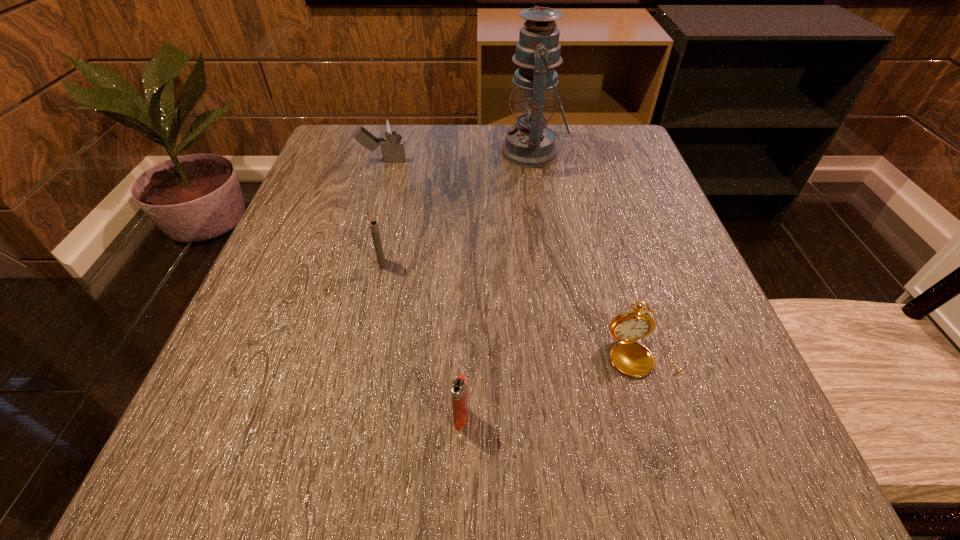
At what (x,y) coordinates should I click in order to perform the action: click on free region at the left edge. Please return your answer as a coordinate pair (x, y). The image size is (960, 540). Looking at the image, I should click on point(232,353).

This screenshot has width=960, height=540. Find the location of `free space at the right edge of the desktop`. free space at the right edge of the desktop is located at coordinates (660, 352).

Locate an element on the screen. Image resolution: width=960 pixels, height=540 pixels. free space at the far left corner of the desktop is located at coordinates (324, 150).

At what (x,y) coordinates should I click in order to perform the action: click on blank space at the far right corner of the desktop. Please return your answer as a coordinate pair (x, y). The width and height of the screenshot is (960, 540). Looking at the image, I should click on (576, 163).

Where is `free location at the near right corner of the desktop`? free location at the near right corner of the desktop is located at coordinates (777, 511).

You are a GUI agent. You are given a task and a screenshot of the screen. Output one action in this format:
    pyautogui.click(x=<x>, y=<y>)
    Task: Click on the vacant space that is in between the tallest object and the second nearest igniter
    
    Given the screenshot: What is the action you would take?
    pyautogui.click(x=457, y=208)

Image resolution: width=960 pixels, height=540 pixels. In order to click on vacant area that lies between the third farthest object and the nearest object in this screenshot , I will do `click(421, 341)`.

Locate an element on the screen. This screenshot has width=960, height=540. free spot between the fourth farthest object and the second nearest igniter is located at coordinates (513, 309).

This screenshot has height=540, width=960. I want to click on vacant space that's between the farthest igniter and the fourth farthest object, so click(514, 258).

You are a GUI agent. You are given a task and a screenshot of the screen. Output one action in this format:
    pyautogui.click(x=<x>, y=<y>)
    Task: Click on the vacant space in between the second farthest igniter and the pocket watch
    
    Given the screenshot: What is the action you would take?
    pyautogui.click(x=513, y=309)